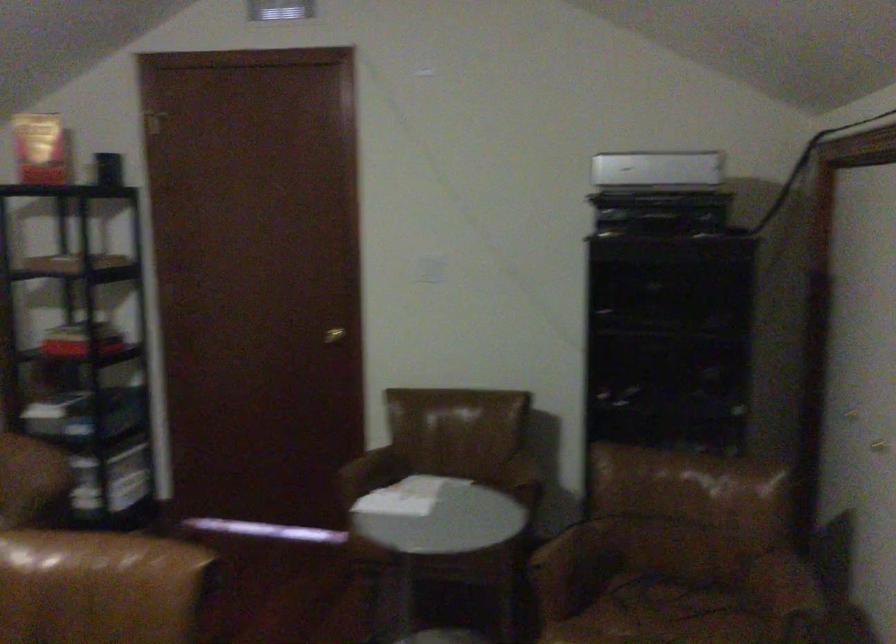
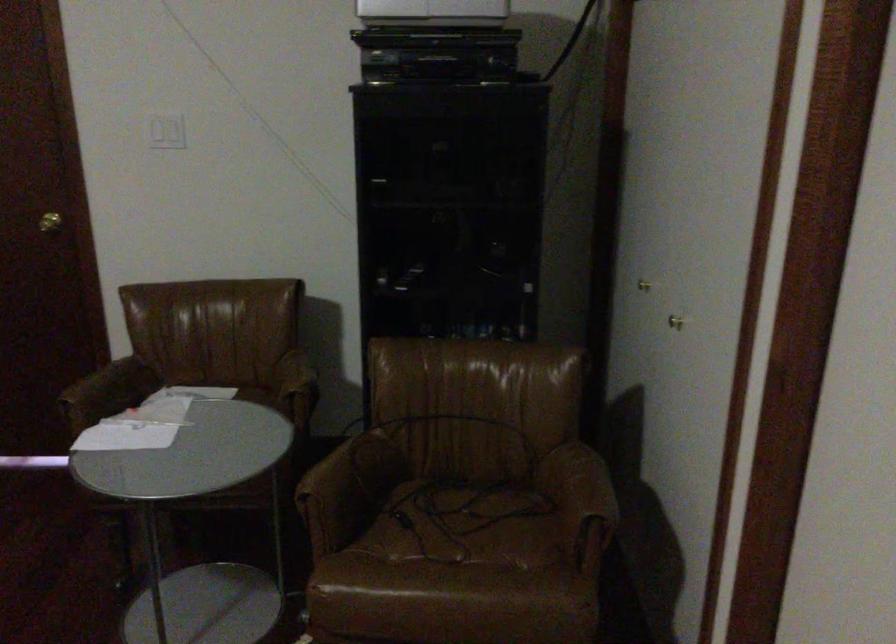
Find the pixel in the second image that matches (337,337) in the first image.

(49, 222)